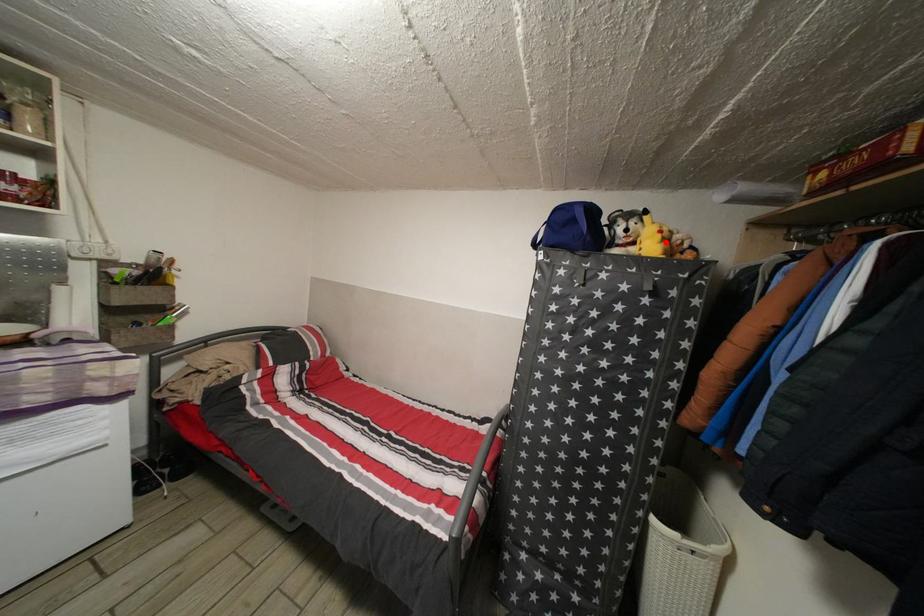
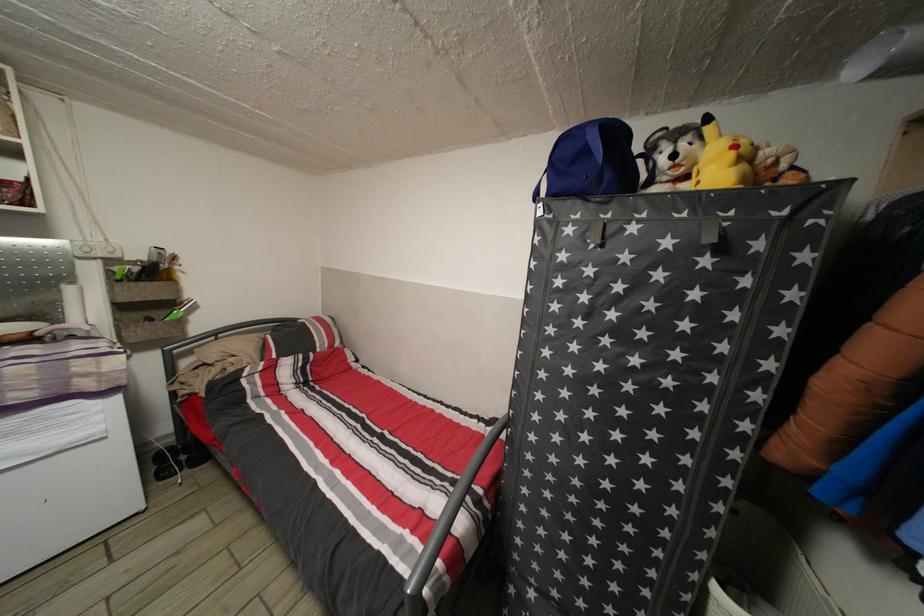
Locate, in the second image, the point that corresponds to the highlighted location in the first image.

(738, 161)